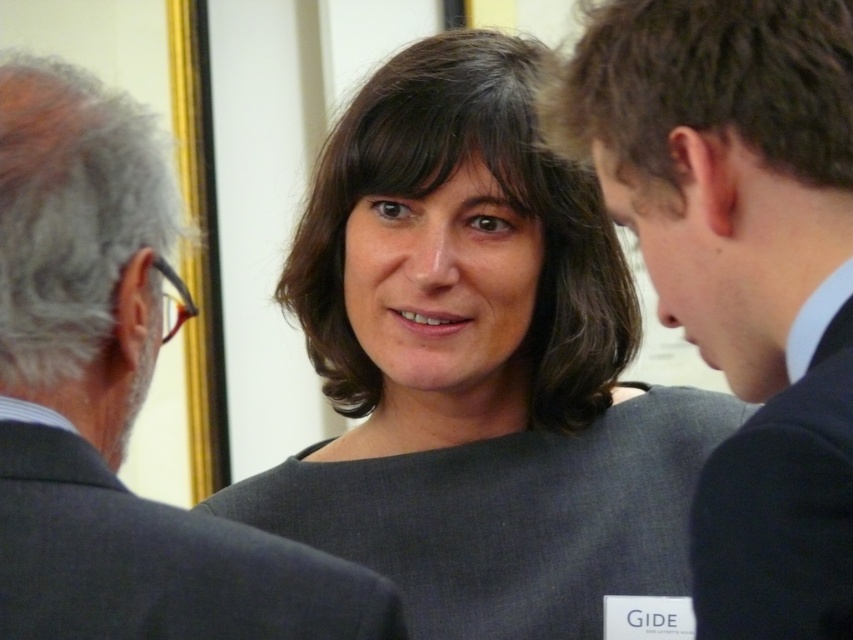
Between black suit at center and dark gray wool suit at center, which one is positioned lower?

dark gray wool suit at center is lower down.

Based on the photo, measure the distance between point (633, 189) and camera.

A distance of 28.73 inches exists between point (633, 189) and camera.

Locate an element on the screen. This screenshot has height=640, width=853. black suit at center is located at coordinates (741, 269).

Is point (47, 141) positioned before point (41, 481)?

No.

Does dark gray suit at center have a lesser height compared to dark gray wool suit at center?

No, dark gray suit at center is not shorter than dark gray wool suit at center.

Locate an element on the screen. The image size is (853, 640). dark gray suit at center is located at coordinates (117, 400).

Can you confirm if black suit at center is bigger than dark gray suit at center?

Incorrect, black suit at center is not larger than dark gray suit at center.

Based on the photo, between black suit at center and dark gray suit at center, which one has more height?

black suit at center is taller.

Is point (775, 406) closer to viewer compared to point (190, 584)?

That is True.

The image size is (853, 640). What are the coordinates of `black suit at center` in the screenshot? It's located at (741, 269).